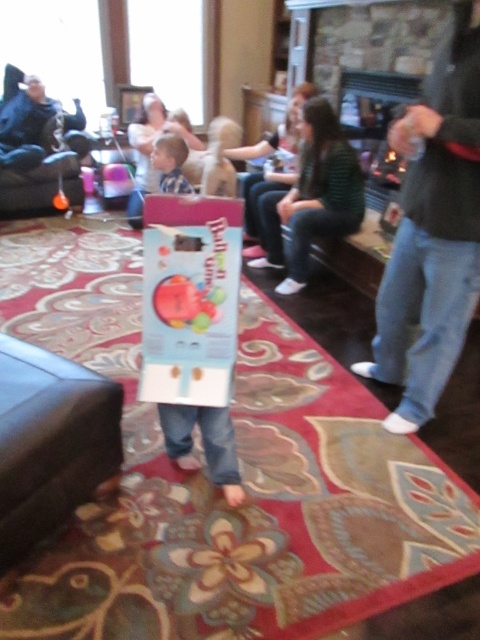
You are a guest at the gathering and notice a child in the center of the room. Which item is positioned to the right of the other between the jeans at center and the light brown hair at center?

The jeans at center are to the right of the light brown hair at center.

You are a photographer trying to capture a closeup of the child in the cardboard box costume. Since the jeans at center and light brown hair at center are both visible in the frame, which one should you focus on to ensure the subject is clear?

The jeans at center is larger in size than the light brown hair at center, so focusing on the jeans at center would ensure the subject is clear as it takes up more space in the frame.

You are standing at point (151, 160) and want to walk to the entrance of the living room. There is an obstacle at point (420, 316). Will you pass in front of or behind the obstacle while moving towards the entrance?

Since point (420, 316) is in front of point (151, 160), you will pass in front of the obstacle while moving towards the entrance.